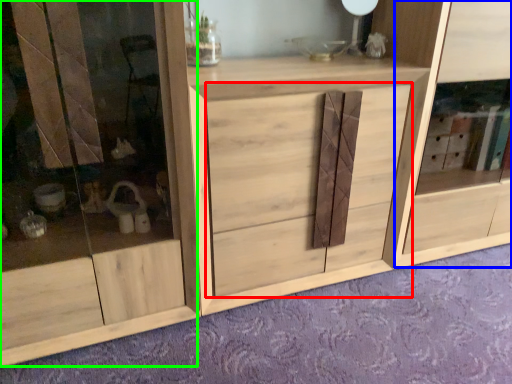
Question: Estimate the real-world distances between objects in this image. Which object is farther from drawer (highlighted by a red box), cabinet (highlighted by a blue box) or screen door (highlighted by a green box)?

Choices:
 (A) cabinet
 (B) screen door

Answer: (A)